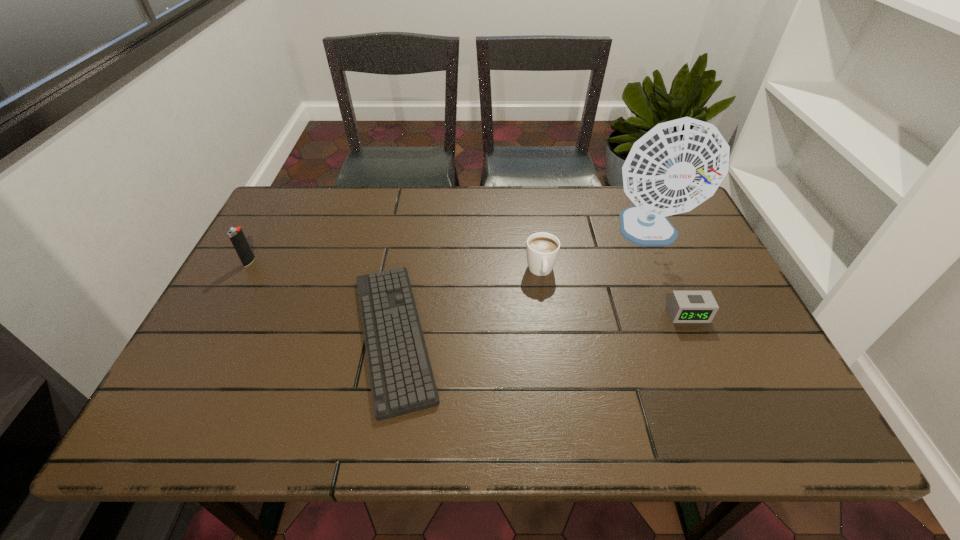
Find the location of a particular element. This screenshot has width=960, height=540. free area in between the fourth tallest object and the leftmost object is located at coordinates click(x=468, y=288).

Image resolution: width=960 pixels, height=540 pixels. I want to click on unoccupied area between the tallest object and the computer keyboard, so click(521, 285).

Identify the location of vacant space in between the alarm clock and the tallest object. (668, 274).

You are a GUI agent. You are given a task and a screenshot of the screen. Output one action in this format:
    pyautogui.click(x=<x>, y=<y>)
    Task: Click on the empty space that is in between the fan and the fourth shortest object
    The height and width of the screenshot is (540, 960).
    Given the screenshot: What is the action you would take?
    pyautogui.click(x=449, y=248)

Locate an element on the screen. free space between the tallest object and the fourth tallest object is located at coordinates (668, 274).

In order to click on object that is the closest one to the shortest object in this screenshot , I will do `click(542, 249)`.

Identify which object is the fourth closest to the third shortest object. Please provide its 2D coordinates. Your answer should be formatted as a tuple, i.e. [(x, y)], where the tuple contains the x and y coordinates of a point satisfying the conditions above.

[(236, 235)]